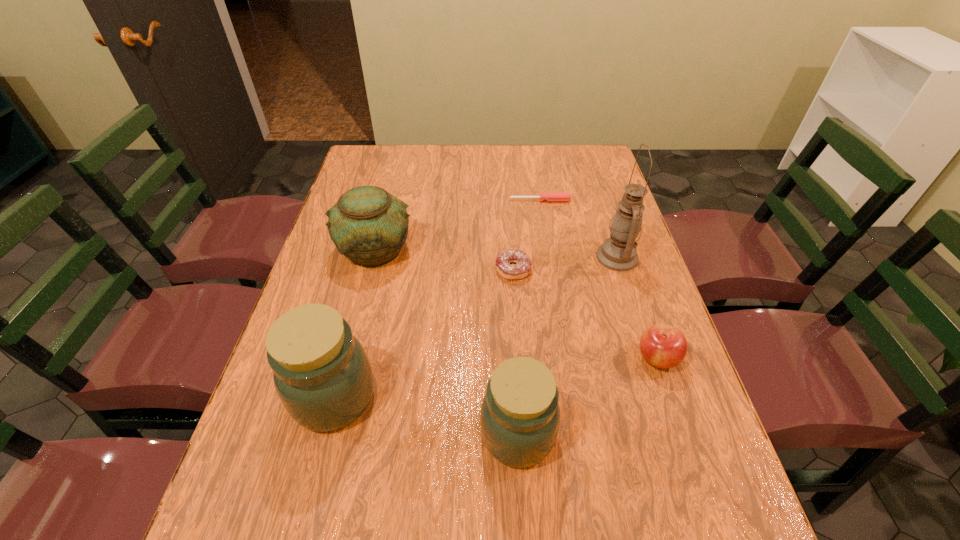
Find the location of a particular element. This screenshot has width=960, height=540. object that stands as the fourth closest to the apple is located at coordinates (550, 196).

Identify the location of free space that satisfies the following two spatial constraints: 1. on the back side of the sixth tallest object; 2. on the right side of the right jar. (508, 270).

You are a GUI agent. You are given a task and a screenshot of the screen. Output one action in this format:
    pyautogui.click(x=<x>, y=<y>)
    Task: Click on the vacant space that satisfies the following two spatial constraints: 1. on the back side of the left jar; 2. on the right side of the pottery
    This screenshot has width=960, height=540.
    Given the screenshot: What is the action you would take?
    pyautogui.click(x=372, y=250)